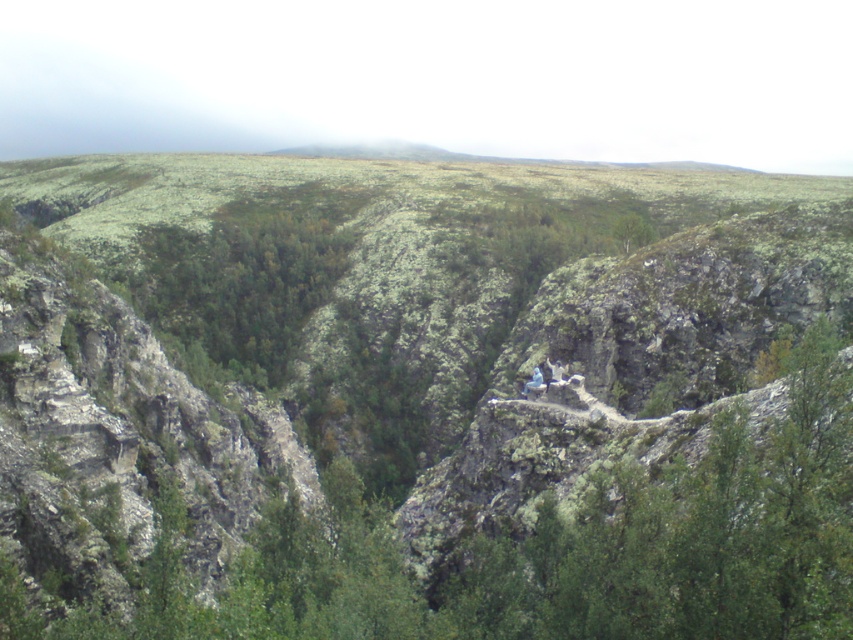
You are a hiker standing at the top of the cliff looking down. You see the green mossy trees at center and the blue fabric person at center. Which object is closer to you from your vantage point?

The green mossy trees at center are closer to you because the blue fabric person at center is positioned behind them.

You are a hiker planning to set up a campsite between the green leafy tree at upper center and the blue fabric person at center. If your tent requires a 30 meter minimum space, will there be enough room?

The distance between the green leafy tree at upper center and the blue fabric person at center is 30.64 meters, which exceeds the required 30 meters. Therefore, there is sufficient space to set up the campsite.

You are a hiker planning to take a photo of the blue fabric person at center and the green mossy trees at center from the path. Which object will appear wider in the photo?

The green mossy trees at center will appear wider in the photo because their width surpasses that of the blue fabric person at center.